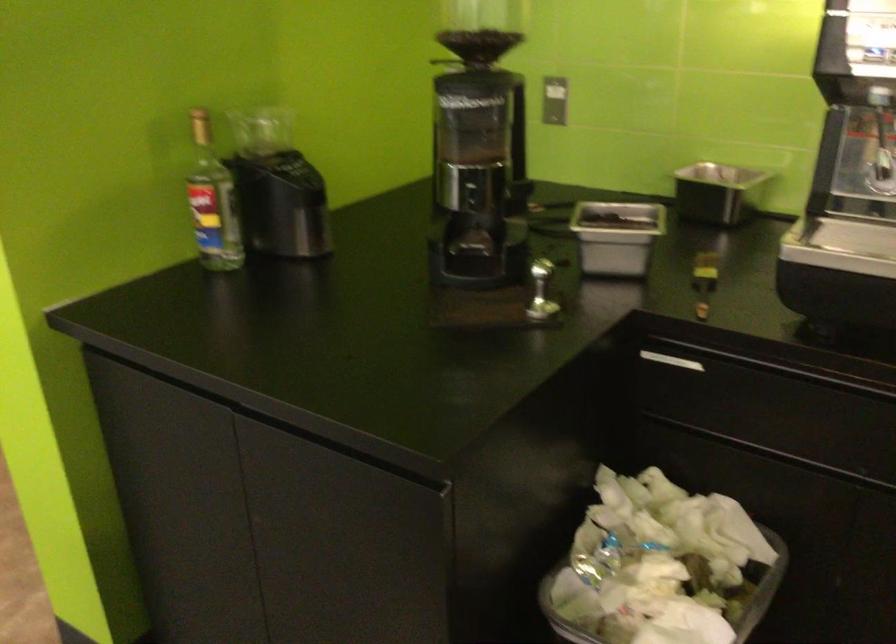
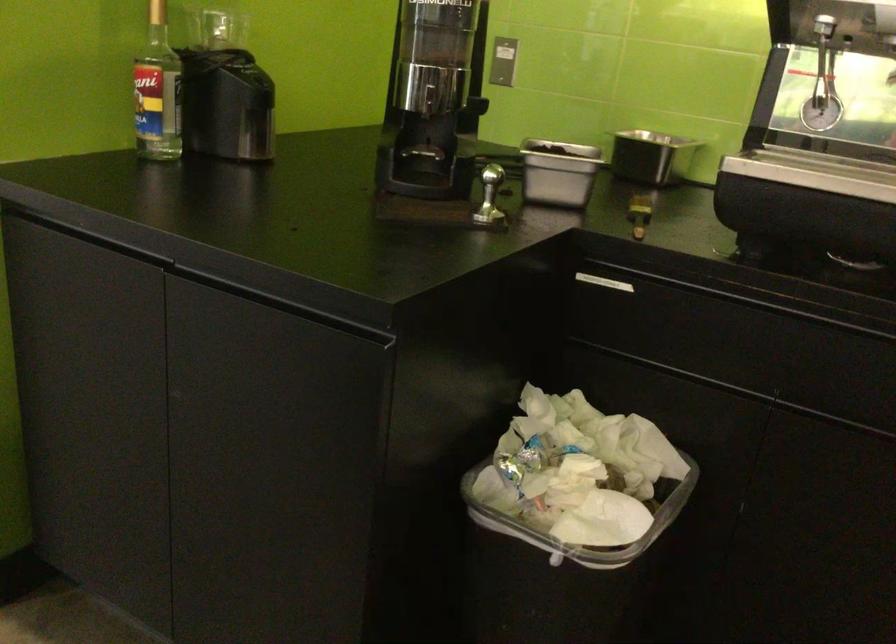
In the second image, find the point that corresponds to (x=475, y=196) in the first image.

(433, 100)